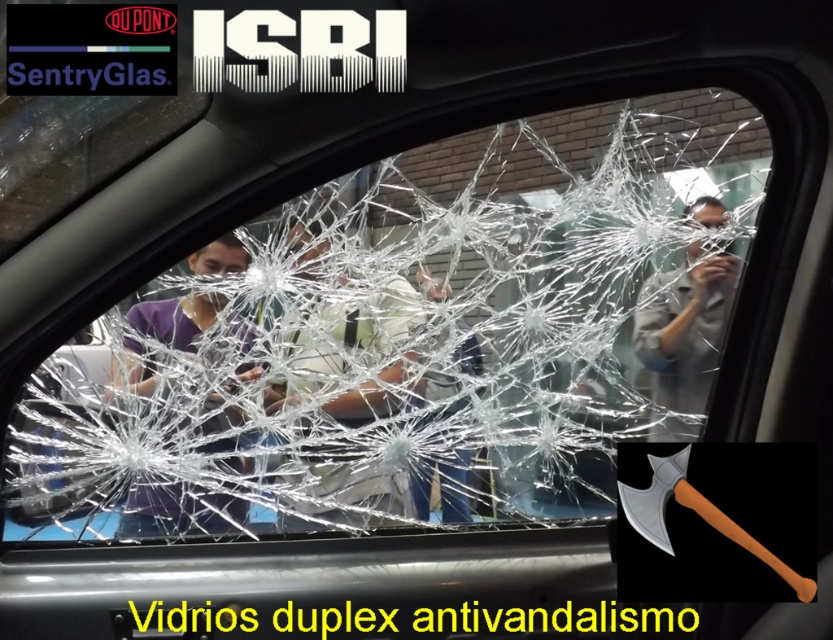
You are a safety inspector examining the shattered car window. You notice a point marked at coordinates (348, 355). What object is located at that point?

The point at coordinates (348, 355) marks the location of the matte black shirt at center.

You are standing outside the car and want to place a small sticker on the window. You have two points to choose from, point (295,400) and point (654,292). Which point is closer to the front of the car?

Point (295,400) is in front of point (654,292), so the sticker placed at point (295,400) would be closer to the front of the car.

Where is the transparent glass at center located in the image?

The transparent glass at center is located at point coordinates of (410, 339).